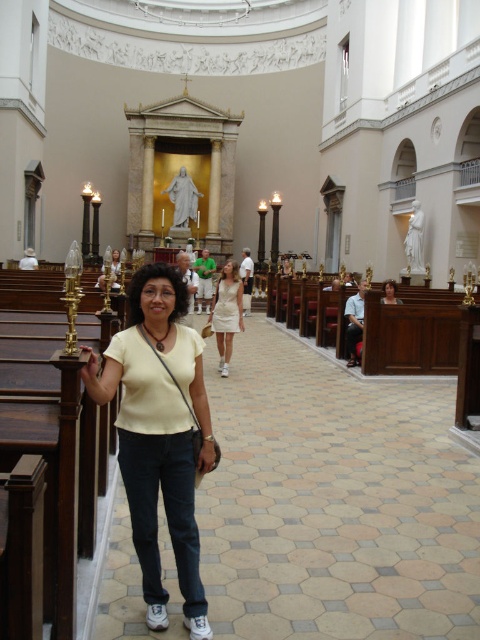
Is point (156, 316) closer to viewer compared to point (230, 339)?

Yes, point (156, 316) is in front of point (230, 339).

Can you confirm if yellow cotton shirt at center is thinner than white cotton dress at center?

Correct, yellow cotton shirt at center's width is less than white cotton dress at center's.

This screenshot has width=480, height=640. What are the coordinates of `yellow cotton shirt at center` in the screenshot? It's located at (158, 433).

Is white cotton dress at center closer to the viewer compared to matte white blouse at center?

Yes.

Does point (224, 317) lie in front of point (389, 284)?

That is True.

What do you see at coordinates (227, 312) in the screenshot? The image size is (480, 640). I see `white cotton dress at center` at bounding box center [227, 312].

The image size is (480, 640). Find the location of `white cotton dress at center`. white cotton dress at center is located at coordinates (227, 312).

Consider the image. Does yellow cotton shirt at center have a lesser height compared to matte white blouse at center?

No, yellow cotton shirt at center is not shorter than matte white blouse at center.

The height and width of the screenshot is (640, 480). What do you see at coordinates (158, 433) in the screenshot?
I see `yellow cotton shirt at center` at bounding box center [158, 433].

You are a GUI agent. You are given a task and a screenshot of the screen. Output one action in this format:
    pyautogui.click(x=<x>, y=<y>)
    Task: Click on the yellow cotton shirt at center
    Image resolution: width=480 pixels, height=640 pixels.
    Given the screenshot: What is the action you would take?
    pyautogui.click(x=158, y=433)